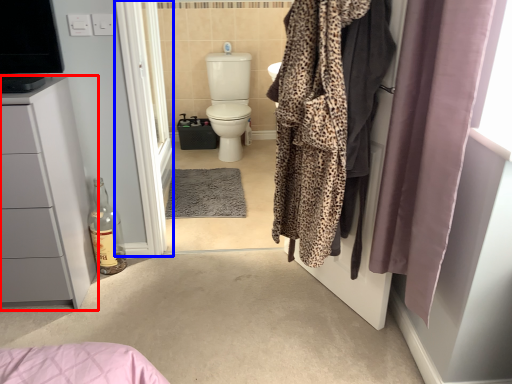
Question: Which object is further to the camera taking this photo, bathroom cabinet (highlighted by a red box) or screen door (highlighted by a blue box)?

Choices:
 (A) bathroom cabinet
 (B) screen door

Answer: (B)